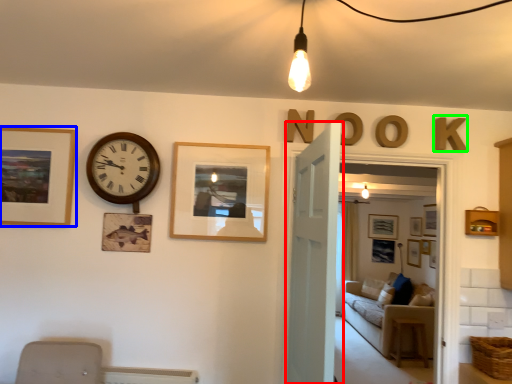
Question: Which is farther away from door (highlighted by a red box)? picture frame (highlighted by a blue box) or letter (highlighted by a green box)?

Choices:
 (A) picture frame
 (B) letter

Answer: (A)